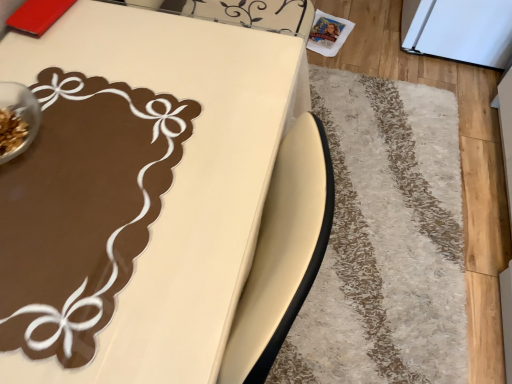
This screenshot has height=384, width=512. Find the location of `blank space situated above matte brown table at upper left (from a real-world perspective)`. blank space situated above matte brown table at upper left (from a real-world perspective) is located at coordinates (135, 156).